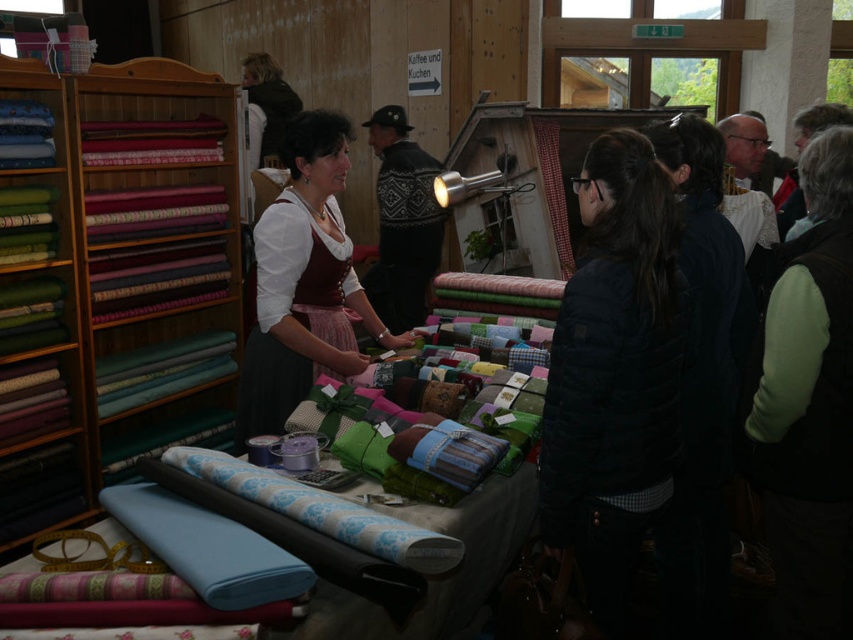
Is black quilted jacket at center in front of knitted sweater at center?

Yes, it is.

Which of these two, black quilted jacket at center or knitted sweater at center, stands taller?

knitted sweater at center is taller.

This screenshot has height=640, width=853. Find the location of `black quilted jacket at center`. black quilted jacket at center is located at coordinates (614, 372).

Locate an element on the screen. black quilted jacket at center is located at coordinates (614, 372).

Is green fleece vest at right below matte brown skirt at center?

Indeed, green fleece vest at right is positioned under matte brown skirt at center.

Is point (849, 193) positioned in front of point (311, 307)?

Yes, point (849, 193) is closer to viewer.

Is point (769, 552) closer to camera compared to point (267, 392)?

That is True.

The height and width of the screenshot is (640, 853). I want to click on green fleece vest at right, so click(809, 404).

Between matte green fabric at left and knitted sweater at center, which one has less height?

Standing shorter between the two is knitted sweater at center.

Is matte green fabric at left further to the viewer compared to knitted sweater at center?

No, matte green fabric at left is in front of knitted sweater at center.

Where is `matte green fabric at left`? The height and width of the screenshot is (640, 853). matte green fabric at left is located at coordinates (126, 269).

Locate an element on the screen. Image resolution: width=853 pixels, height=640 pixels. matte green fabric at left is located at coordinates (126, 269).